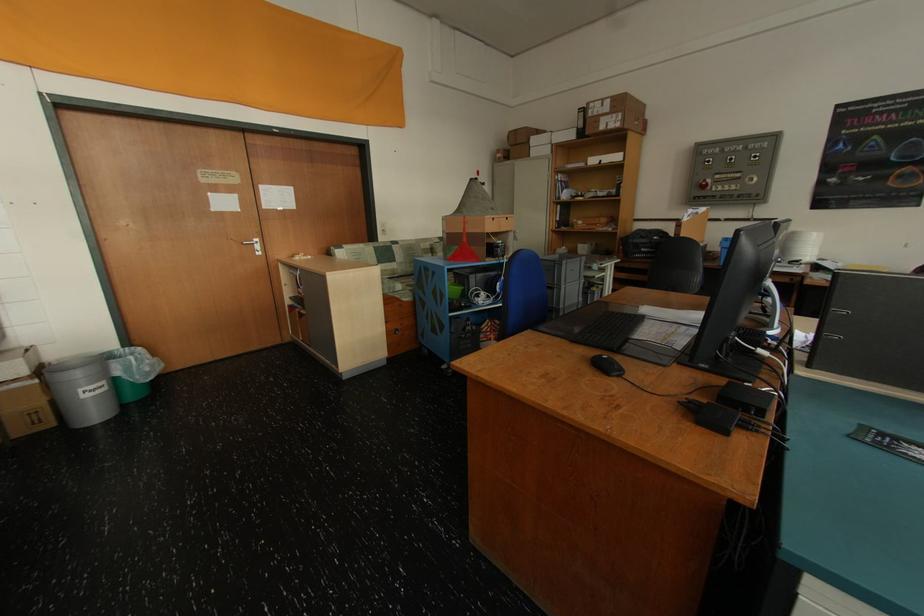
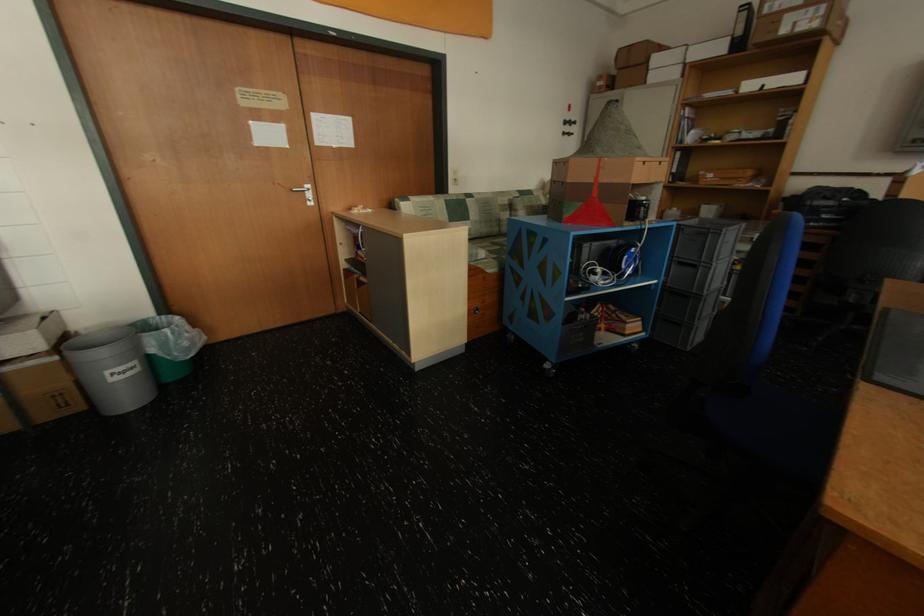
The point at (x=30, y=361) is marked in the first image. Where is the corresponding point in the second image?

(43, 333)